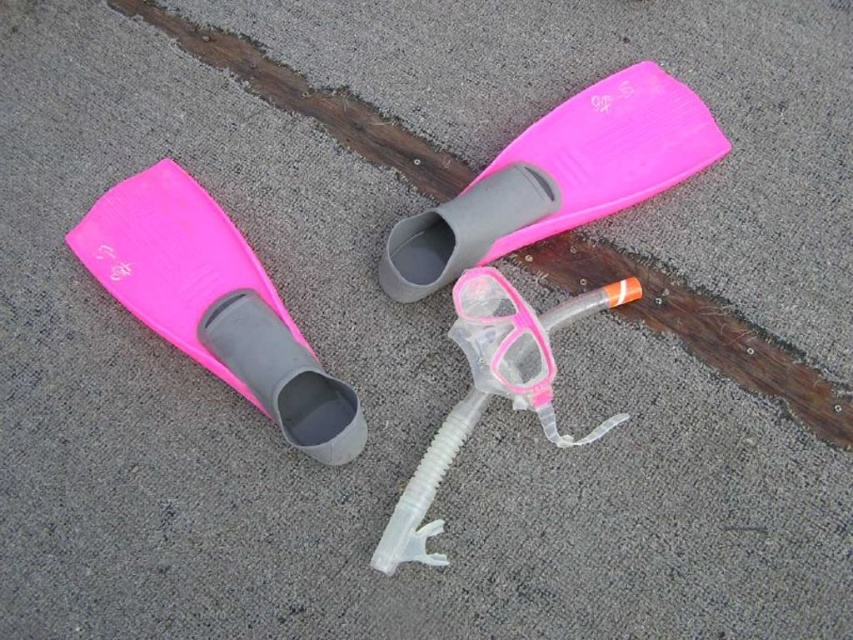
Question: Is pink matte plastic fins at left bigger than pink plastic goggles at center?

Choices:
 (A) no
 (B) yes

Answer: (B)

Question: Can you confirm if pink matte flippers at upper center is positioned below pink plastic goggles at center?

Choices:
 (A) yes
 (B) no

Answer: (B)

Question: Which point is farther to the camera?

Choices:
 (A) pink matte plastic fins at left
 (B) pink matte flippers at upper center
 (C) pink plastic goggles at center

Answer: (B)

Question: Can you confirm if pink matte flippers at upper center is thinner than pink plastic goggles at center?

Choices:
 (A) yes
 (B) no

Answer: (B)

Question: Which point is farther to the camera?

Choices:
 (A) pink matte plastic fins at left
 (B) pink plastic goggles at center
 (C) pink matte flippers at upper center

Answer: (C)

Question: Based on their relative distances, which object is farther from the pink matte flippers at upper center?

Choices:
 (A) pink matte plastic fins at left
 (B) pink plastic goggles at center

Answer: (A)